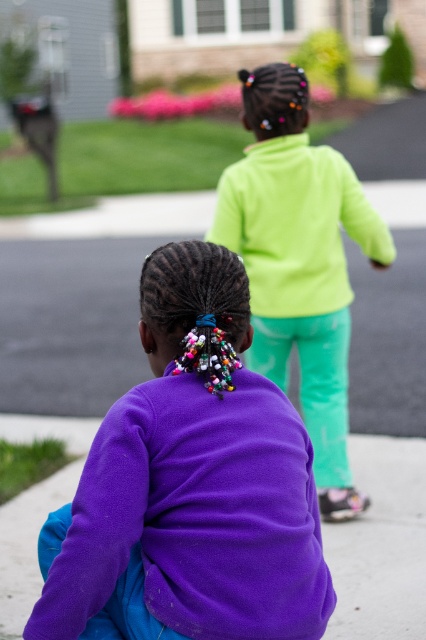
Which is below, purple fleece jacket at lower left or neon green fleece at upper center?

purple fleece jacket at lower left is lower down.

Can you confirm if purple fleece jacket at lower left is smaller than neon green fleece at upper center?

Yes, purple fleece jacket at lower left is smaller than neon green fleece at upper center.

The image size is (426, 640). I want to click on purple fleece jacket at lower left, so click(195, 481).

I want to click on purple fleece jacket at lower left, so [x=195, y=481].